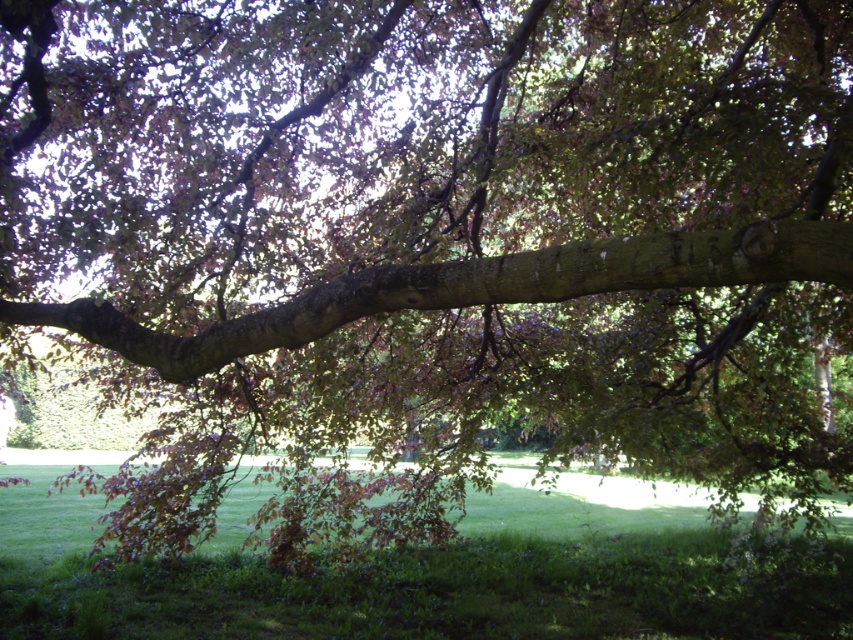
Question: In this image, where is green grassy at lower center located relative to smooth brown branch at center?

Choices:
 (A) above
 (B) below

Answer: (B)

Question: Does green grassy at lower center have a greater width compared to smooth brown branch at center?

Choices:
 (A) no
 (B) yes

Answer: (B)

Question: Which point is farther to the camera?

Choices:
 (A) (350, 600)
 (B) (227, 342)

Answer: (A)

Question: Can you confirm if green grassy at lower center is positioned to the right of smooth brown branch at center?

Choices:
 (A) yes
 (B) no

Answer: (B)

Question: Which point appears farthest from the camera in this image?

Choices:
 (A) (494, 513)
 (B) (416, 304)

Answer: (A)